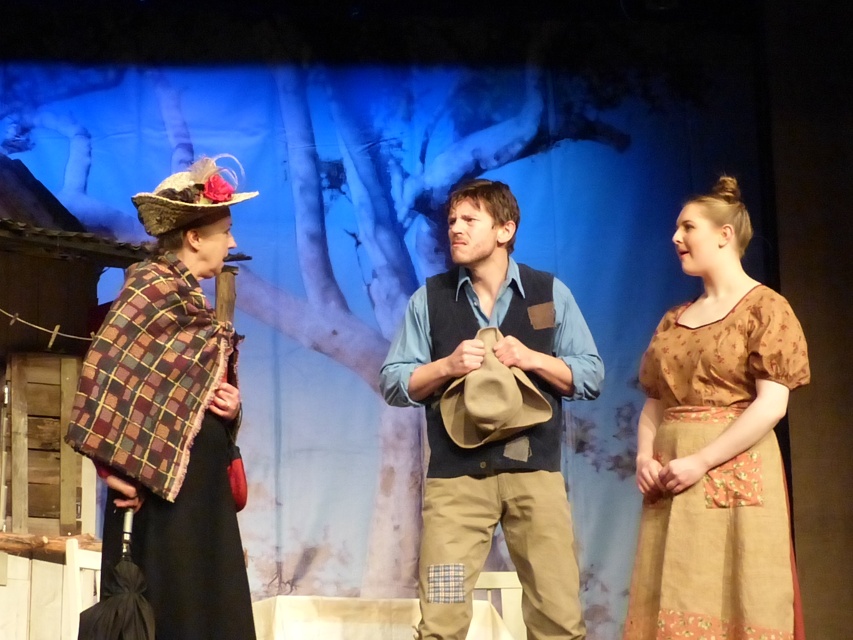
You are an audience member sitting in the front row of the theater. You notice two points on the stage marked as point 1 at coordinates [714,282] and point 2 at coordinates [222,196]. Which point is closer to you?

Point 1 at coordinates [714,282] is closer to you because it is further to the viewer than point 2 at coordinates [222,196].